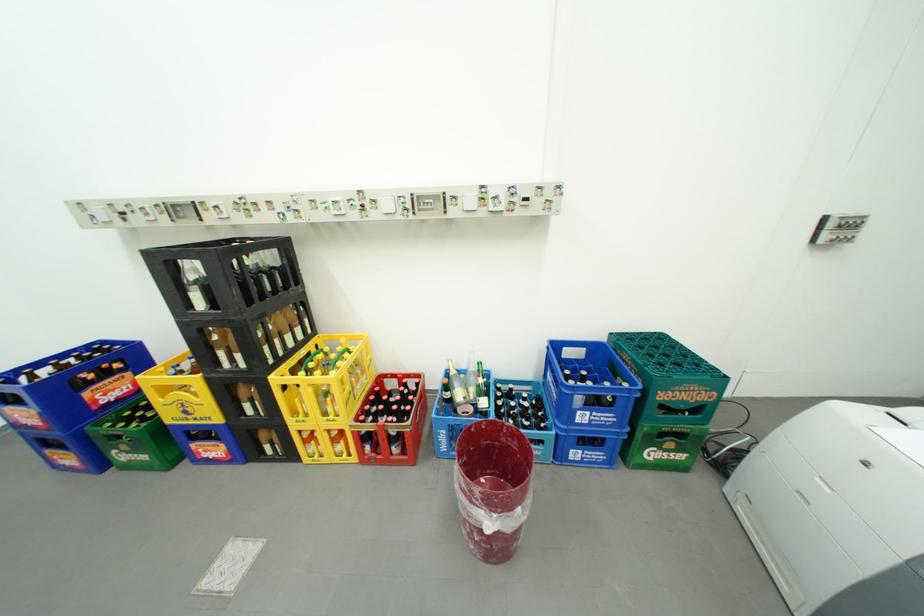
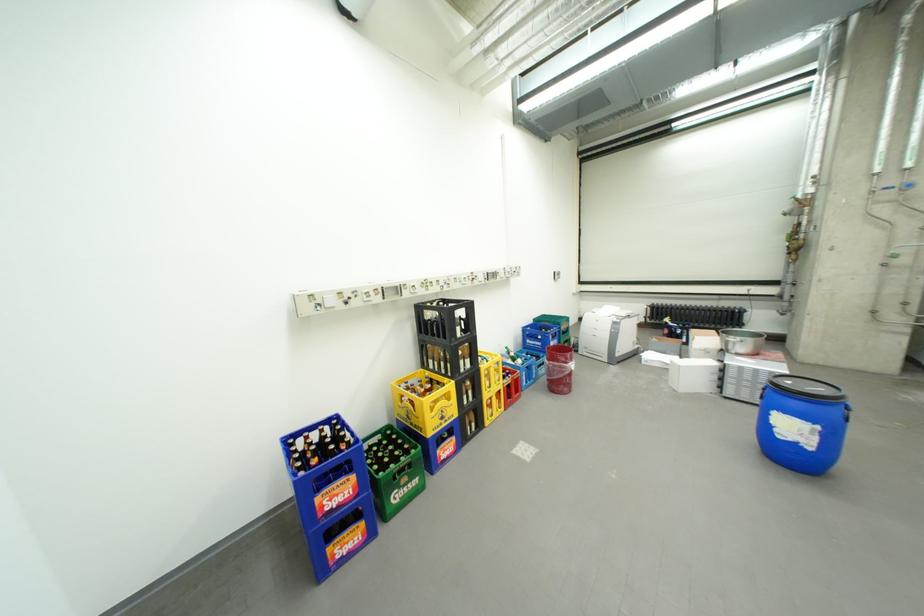
Locate, in the second image, the point that corresponds to point (590, 414) in the first image.

(562, 344)